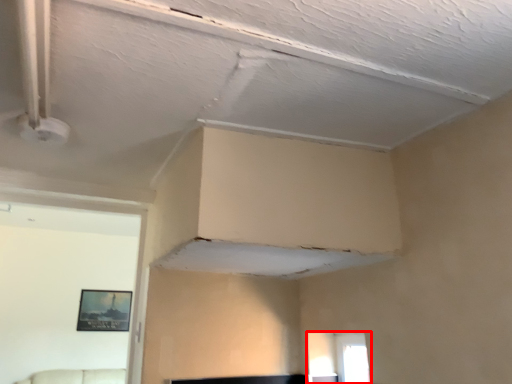
Question: Observing the image, what is the correct spatial positioning of window (annotated by the red box) in reference to picture frame?

Choices:
 (A) right
 (B) left

Answer: (A)